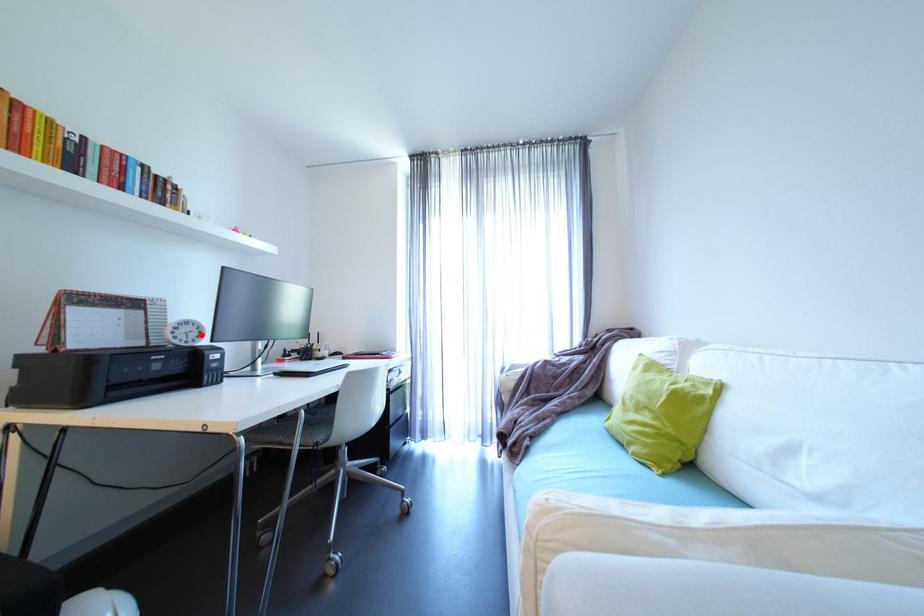
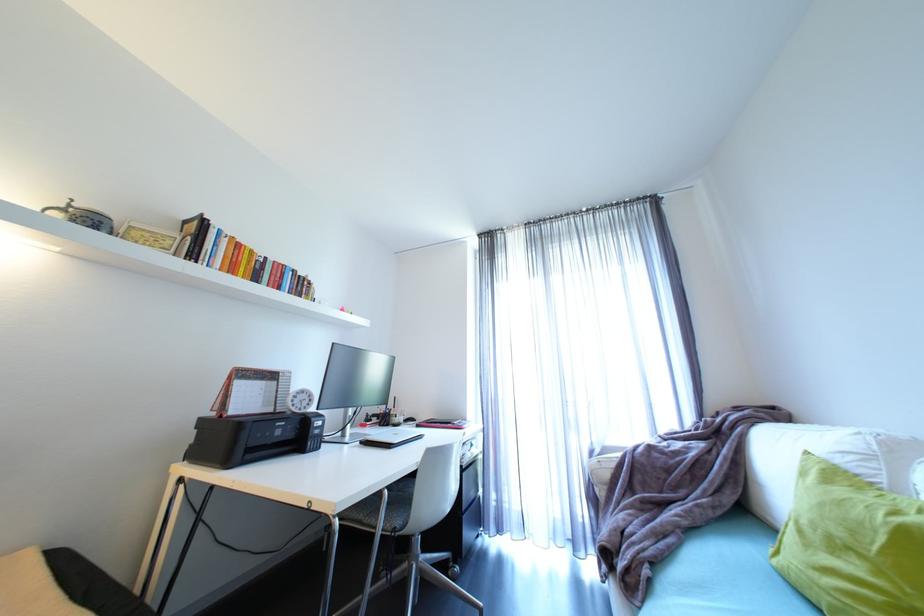
In the second image, find the point that corresponds to the highlighted location in the first image.

(312, 402)